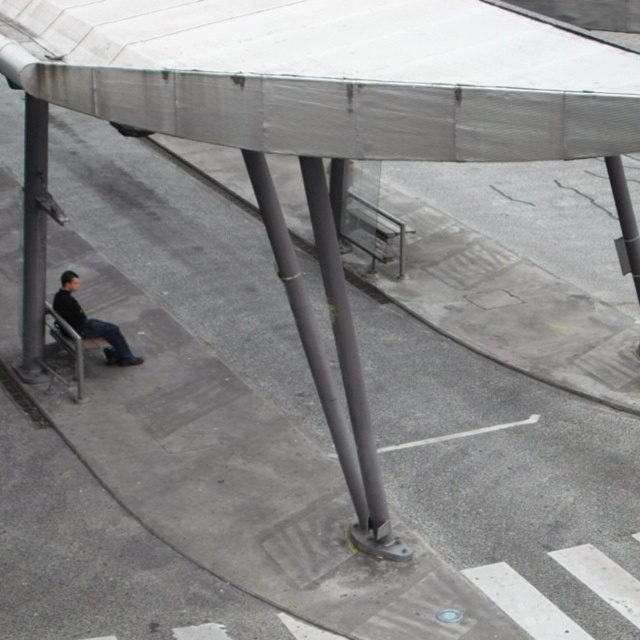
Question: Which of these objects is positioned closest to the gray metallic pole at center?

Choices:
 (A) smooth gray pole at center
 (B) dark gray leather jacket at lower left

Answer: (A)

Question: Can you confirm if gray metallic pole at left is wider than dark gray leather jacket at lower left?

Choices:
 (A) no
 (B) yes

Answer: (A)

Question: Which of these objects is positioned closest to the gray metallic pole at center?

Choices:
 (A) gray metallic pole at left
 (B) smooth gray pole at center
 (C) dark gray leather jacket at lower left

Answer: (B)

Question: Can you confirm if gray metallic pole at center is bigger than smooth gray pole at center?

Choices:
 (A) no
 (B) yes

Answer: (B)

Question: Considering the real-world distances, which object is closest to the gray metallic pole at center?

Choices:
 (A) smooth gray pole at center
 (B) gray metallic pole at left

Answer: (A)

Question: Is gray metallic pole at left smaller than dark gray leather jacket at lower left?

Choices:
 (A) yes
 (B) no

Answer: (B)